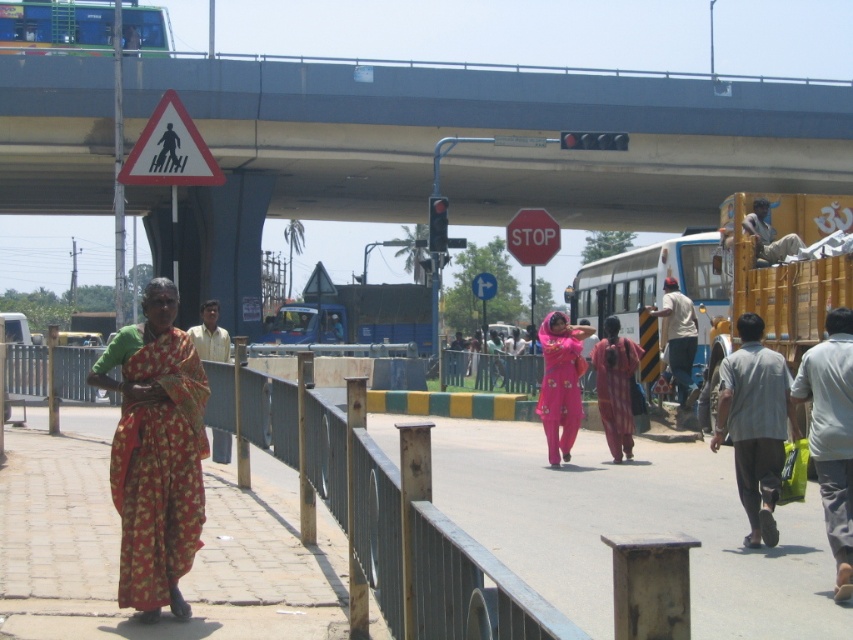
You are standing at the pedestrian crossing and want to reach the STOP sign. There are two points marked in the scene. Which point should you go through first? The points are point at coordinates (x=612, y=266) and point at coordinates (x=563, y=426).

You should go through point at coordinates (x=563, y=426) first because point at coordinates (x=612, y=266) is behind it, so the first point on your path would be point at coordinates (x=563, y=426).